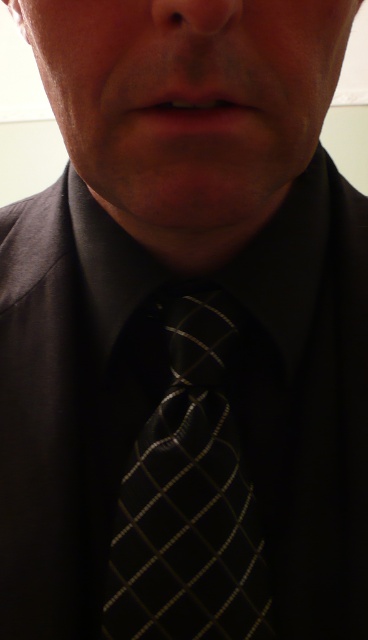
Between black textured tie at center and matte black tie at center, which one has less height?

black textured tie at center

Which is below, black textured tie at center or matte black tie at center?

black textured tie at center is below.

Measure the distance between point (193,388) and camera.

Point (193,388) is 14.10 inches from camera.

Identify the location of black textured tie at center. (189, 496).

Is point (352, 172) positioned behind point (199, 19)?

Yes, it is.

Measure the distance between point (334, 150) and camera.

Point (334, 150) is 9.04 feet away from camera.

Is point (8, 148) positioned in front of point (178, 13)?

No, it is behind (178, 13).

You are a GUI agent. You are given a task and a screenshot of the screen. Output one action in this format:
    pyautogui.click(x=<x>, y=<y>)
    Task: Click on the matte black tie at center
    The height and width of the screenshot is (640, 368).
    Given the screenshot: What is the action you would take?
    pyautogui.click(x=25, y=120)

Does black textured tie at center appear on the right side of matte skin nose at center?

In fact, black textured tie at center is to the left of matte skin nose at center.

Who is positioned more to the right, black textured tie at center or matte skin nose at center?

Positioned to the right is matte skin nose at center.

This screenshot has height=640, width=368. I want to click on black textured tie at center, so click(x=189, y=496).